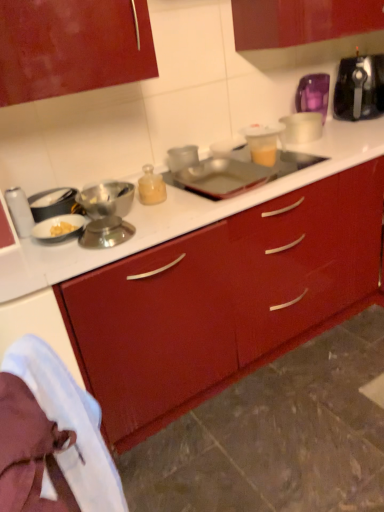
Locate an element on the screen. The width and height of the screenshot is (384, 512). free space in front of metallic canister at left, arranged as the 4th appliance when viewed from the right is located at coordinates (47, 250).